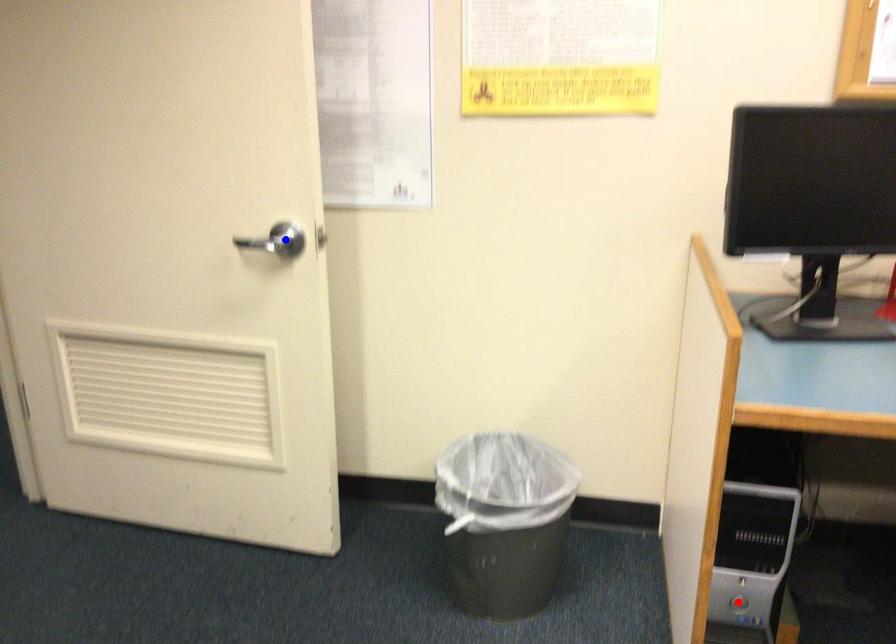
Question: In the image, two points are highlighted. Which point is nearer to the camera? Reply with the corresponding letter.

Choices:
 (A) blue point
 (B) red point

Answer: (B)